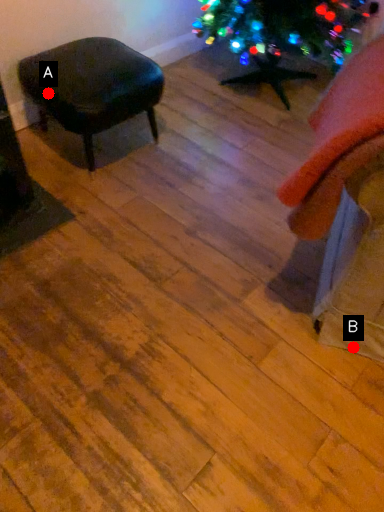
Question: Two points are circled on the image, labeled by A and B beside each circle. Among these points, which one is nearest to the camera?

Choices:
 (A) A is closer
 (B) B is closer

Answer: (B)